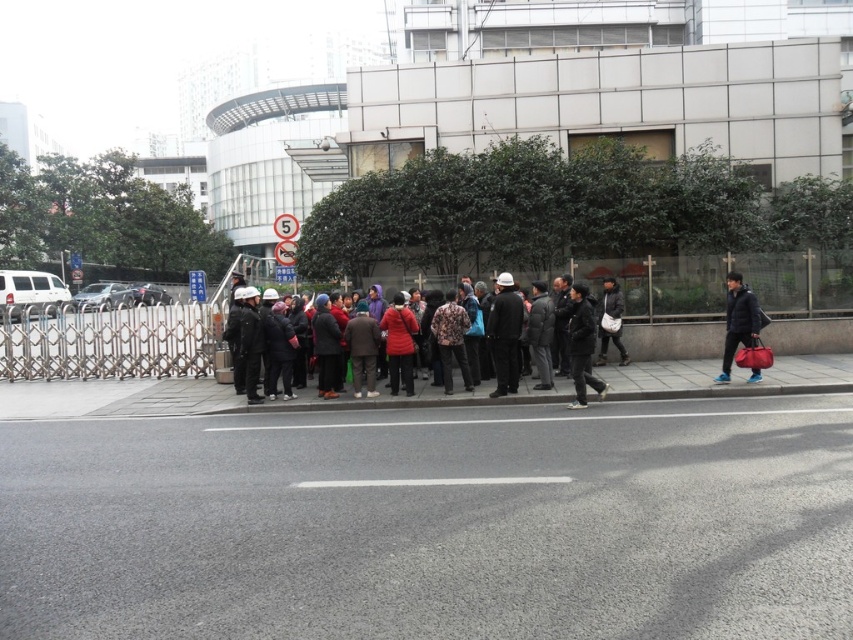
In the scene shown: You are standing at the edge of the road and want to walk to the gray asphalt pavement at center. Which direction should you walk to reach it?

You should walk towards the center of the road to reach the gray asphalt pavement at center.